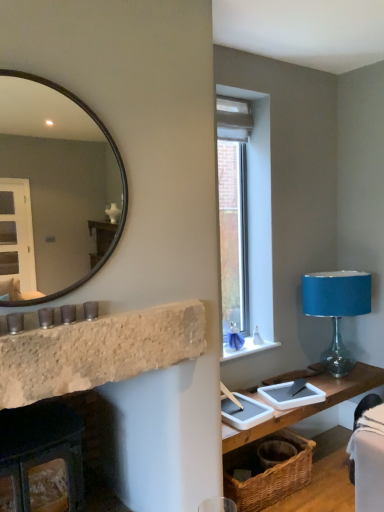
Describe the element at coordinates (55, 189) in the screenshot. I see `black glass mirror at upper left` at that location.

What is the approximate height of woven brown basket at lower right?

It is 10.02 inches.

Image resolution: width=384 pixels, height=512 pixels. What do you see at coordinates (41, 448) in the screenshot?
I see `rustic stone fireplace at left, which is counted as the second fireplace, starting from the top` at bounding box center [41, 448].

Identify the location of rustic stone fireplace at left, which is counted as the second fireplace, starting from the top. (41, 448).

In order to face clear glass window at upper right, should I rotate leftwards or rightwards?

To align with it, rotate right about 5.605°.

Locate an element on the screen. velvet black swivel chair at lower right is located at coordinates (368, 456).

Looking at this image, would you say woven brown basket at lower right is inside or outside white stone window sill at center?

woven brown basket at lower right is not inside white stone window sill at center, it's outside.

At what (x,y) coordinates should I click in order to perform the action: click on window sill located above the woven brown basket at lower right (from a real-world perspective). Please return your answer as a coordinate pair (x, y). Image resolution: width=384 pixels, height=512 pixels. Looking at the image, I should click on (246, 349).

From the image's perspective, is woven brown basket at lower right above white stone window sill at center?

Incorrect, from the image's perspective, woven brown basket at lower right is lower than white stone window sill at center.

Would you say woven brown basket at lower right is a long distance from white stone window sill at center?

Actually, woven brown basket at lower right and white stone window sill at center are a little close together.

Is blue fabric-covered lamp at right in front of rustic stone fireplace at left, which ranks as the first fireplace in top-to-bottom order?

No, it is not.

In terms of width, does blue fabric-covered lamp at right look wider or thinner when compared to rustic stone fireplace at left, the second fireplace when ordered from bottom to top?

Clearly, blue fabric-covered lamp at right has more width compared to rustic stone fireplace at left, the second fireplace when ordered from bottom to top.

Considering the positions of points (364, 298) and (80, 328), is point (364, 298) closer to camera compared to point (80, 328)?

That is False.

Is blue fabric-covered lamp at right bigger or smaller than rustic stone fireplace at left, the second fireplace when ordered from bottom to top?

blue fabric-covered lamp at right is bigger than rustic stone fireplace at left, the second fireplace when ordered from bottom to top.

From the image's perspective, is rustic stone fireplace at left, which is counted as the second fireplace, starting from the top, located above woven wood table at lower right?

Correct, rustic stone fireplace at left, which is counted as the second fireplace, starting from the top, appears higher than woven wood table at lower right in the image.

Looking at their sizes, would you say rustic stone fireplace at left, acting as the first fireplace starting from the bottom, is wider or thinner than woven wood table at lower right?

In the image, rustic stone fireplace at left, acting as the first fireplace starting from the bottom, appears to be more narrow than woven wood table at lower right.

Is point (37, 426) closer or farther from the camera than point (294, 412)?

Point (37, 426) is closer to the camera than point (294, 412).

Is white stone window sill at center thinner than rustic stone fireplace at left, the second fireplace when ordered from bottom to top?

Incorrect, the width of white stone window sill at center is not less than that of rustic stone fireplace at left, the second fireplace when ordered from bottom to top.

Considering the relative positions of white stone window sill at center and rustic stone fireplace at left, which ranks as the first fireplace in top-to-bottom order, in the image provided, is white stone window sill at center behind rustic stone fireplace at left, which ranks as the first fireplace in top-to-bottom order,?

Yes, white stone window sill at center is further from the viewer.

Identify the location of the 2nd fireplace in front when counting from the white stone window sill at center. (98, 351).

From a real-world perspective, between white stone window sill at center and rustic stone fireplace at left, the second fireplace when ordered from bottom to top, who is vertically higher?

rustic stone fireplace at left, the second fireplace when ordered from bottom to top, is physically above.

Who is smaller, rustic stone fireplace at left, which ranks as the first fireplace in top-to-bottom order, or velvet black swivel chair at lower right?

With smaller size is rustic stone fireplace at left, which ranks as the first fireplace in top-to-bottom order.

Which is behind, point (66, 383) or point (379, 499)?

Positioned behind is point (379, 499).

From the image's perspective, between rustic stone fireplace at left, the second fireplace when ordered from bottom to top, and velvet black swivel chair at lower right, who is located below?

velvet black swivel chair at lower right is shown below in the image.

This screenshot has width=384, height=512. Identify the location of fireplace that is the 2nd object above the velvet black swivel chair at lower right (from a real-world perspective). (98, 351).

From a real-world perspective, is woven wood table at lower right physically located above or below black glass mirror at upper left?

woven wood table at lower right is situated lower than black glass mirror at upper left in the real world.

Could you tell me if woven wood table at lower right is facing black glass mirror at upper left?

No, woven wood table at lower right is not facing towards black glass mirror at upper left.

How much distance is there between woven wood table at lower right and black glass mirror at upper left?

The distance of woven wood table at lower right from black glass mirror at upper left is 2.83 meters.

Is woven wood table at lower right wider or thinner than black glass mirror at upper left?

Considering their sizes, woven wood table at lower right looks broader than black glass mirror at upper left.

Considering the sizes of objects woven brown basket at lower right and velvet black swivel chair at lower right in the image provided, who is taller, woven brown basket at lower right or velvet black swivel chair at lower right?

Standing taller between the two is velvet black swivel chair at lower right.

Would you consider woven brown basket at lower right to be distant from velvet black swivel chair at lower right?

No, woven brown basket at lower right is in close proximity to velvet black swivel chair at lower right.

Does woven brown basket at lower right have a smaller size compared to velvet black swivel chair at lower right?

No, woven brown basket at lower right is not smaller than velvet black swivel chair at lower right.

This screenshot has height=512, width=384. I want to click on basket that is in front of the white stone window sill at center, so click(267, 472).

The width and height of the screenshot is (384, 512). What are the coordinates of `table lamp below the rustic stone fireplace at left, which ranks as the first fireplace in top-to-bottom order (from a real-world perspective)` in the screenshot? It's located at (336, 309).

Looking at this image, considering their positions, is black glass mirror at upper left positioned closer to velvet black swivel chair at lower right than woven wood table at lower right?

woven wood table at lower right lies closer to velvet black swivel chair at lower right than the other object.

Estimate the real-world distances between objects in this image. Which object is further from rustic stone fireplace at left, acting as the first fireplace starting from the bottom, clear glass window at upper right or woven wood table at lower right?

Among the two, clear glass window at upper right is located further to rustic stone fireplace at left, acting as the first fireplace starting from the bottom.

Looking at the image, which one is located closer to clear glass window at upper right, rustic stone fireplace at left, which ranks as the first fireplace in top-to-bottom order, or velvet black swivel chair at lower right?

velvet black swivel chair at lower right is closer to clear glass window at upper right.

From the image, which object appears to be farther from woven brown basket at lower right, white stone window sill at center or velvet black swivel chair at lower right?

velvet black swivel chair at lower right is positioned further to the anchor woven brown basket at lower right.

From the image, which object appears to be farther from rustic stone fireplace at left, which is counted as the second fireplace, starting from the top, blue fabric-covered lamp at right or black glass mirror at upper left?

black glass mirror at upper left is further to rustic stone fireplace at left, which is counted as the second fireplace, starting from the top.

When comparing their distances from woven brown basket at lower right, does rustic stone fireplace at left, which ranks as the first fireplace in top-to-bottom order, or black glass mirror at upper left seem closer?

Among the two, rustic stone fireplace at left, which ranks as the first fireplace in top-to-bottom order, is located nearer to woven brown basket at lower right.

Estimate the real-world distances between objects in this image. Which object is further from woven brown basket at lower right, blue fabric-covered lamp at right or black glass mirror at upper left?

black glass mirror at upper left.

Which object lies further to the anchor point blue fabric-covered lamp at right, white stone window sill at center or clear glass window at upper right?

The object further to blue fabric-covered lamp at right is clear glass window at upper right.

Image resolution: width=384 pixels, height=512 pixels. I want to click on basket between rustic stone fireplace at left, the second fireplace when ordered from bottom to top, and blue fabric-covered lamp at right, in the horizontal direction, so click(x=267, y=472).

Identify the location of table lamp between white stone window sill at center and velvet black swivel chair at lower right in the horizontal direction. (336, 309).

Find the location of a particular element. Image resolution: width=384 pixels, height=512 pixels. basket located between rustic stone fireplace at left, which ranks as the first fireplace in top-to-bottom order, and velvet black swivel chair at lower right in the left-right direction is located at coordinates (267, 472).

Where is `window sill between rustic stone fireplace at left, which ranks as the first fireplace in top-to-bottom order, and clear glass window at upper right in the front-back direction`? The height and width of the screenshot is (512, 384). window sill between rustic stone fireplace at left, which ranks as the first fireplace in top-to-bottom order, and clear glass window at upper right in the front-back direction is located at coordinates (246, 349).